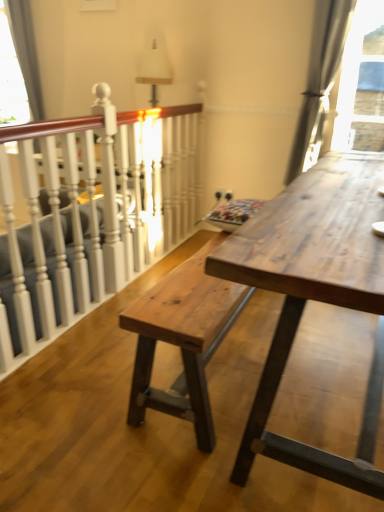
Find the location of a particular element. vacant space underneath natural wood table at center (from a real-world perspective) is located at coordinates (322, 370).